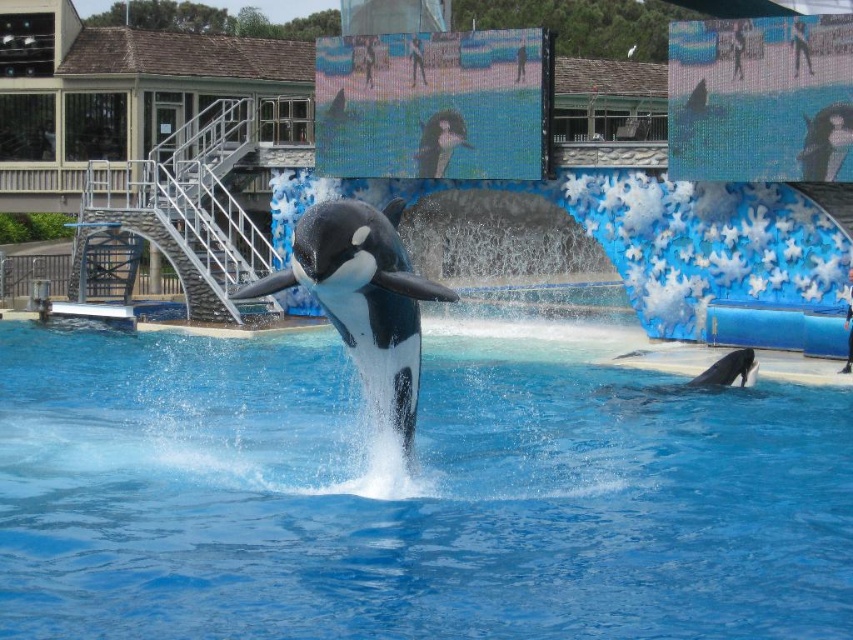
You are a visitor at the marine park and want to take a photo of the smooth gray dolphin at lower right. However, you notice that the blue smooth water at center might be blocking your view. Is the dolphin visible from your current position?

The blue smooth water at center is below the smooth gray dolphin at lower right, so the dolphin is visible as the water is positioned underneath it.

You are a marine biologist observing the orca at the marine park. You notice a specific point marked at coordinates (363, 298). Based on the scene description, can you determine where this point is located on the orca?

The point at coordinates (363, 298) is located on the black smooth orca at center.

You are a visitor standing at the edge of the pool and see the blue smooth water at center and the black smooth orca at center. Which object is located lower in the scene?

The blue smooth water at center is located below the black smooth orca at center, so the blue smooth water at center is lower in the scene.